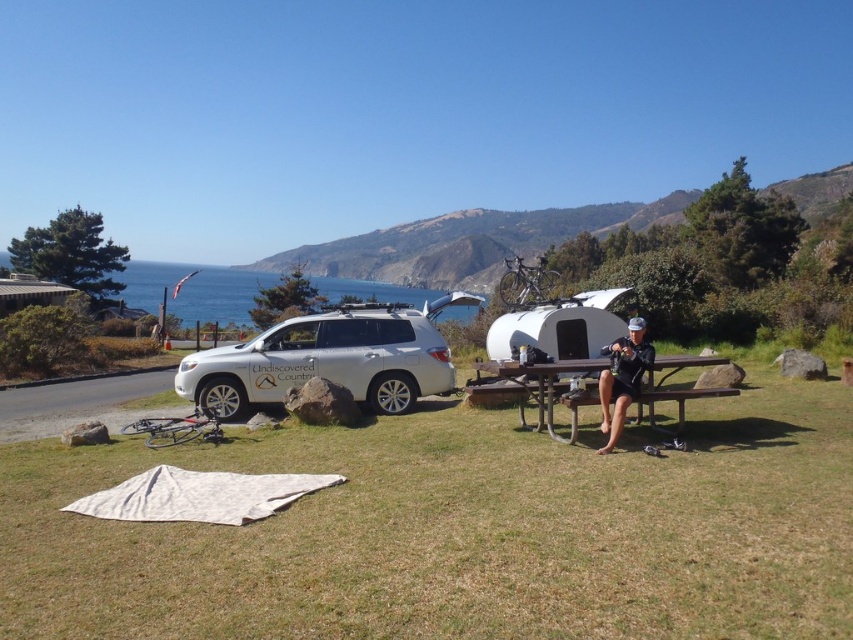
You are planning to take a photo of the metallic silver trailer at center and the blue water at upper left. To ensure both are in the frame, should you adjust your camera to the left or right of the trailer?

The blue water at upper left is positioned on the left side of metallic silver trailer at center, so you should adjust your camera to the left to include both the metallic silver trailer at center and the blue water at upper left in the frame.

Based on the photo, based on the scene, which object occupies a larger portion of the image between the blue water at upper left and the metallic silver trailer at center?

The blue water at upper left is bigger than the metallic silver trailer at center, so the blue water at upper left occupies a larger portion of the image.